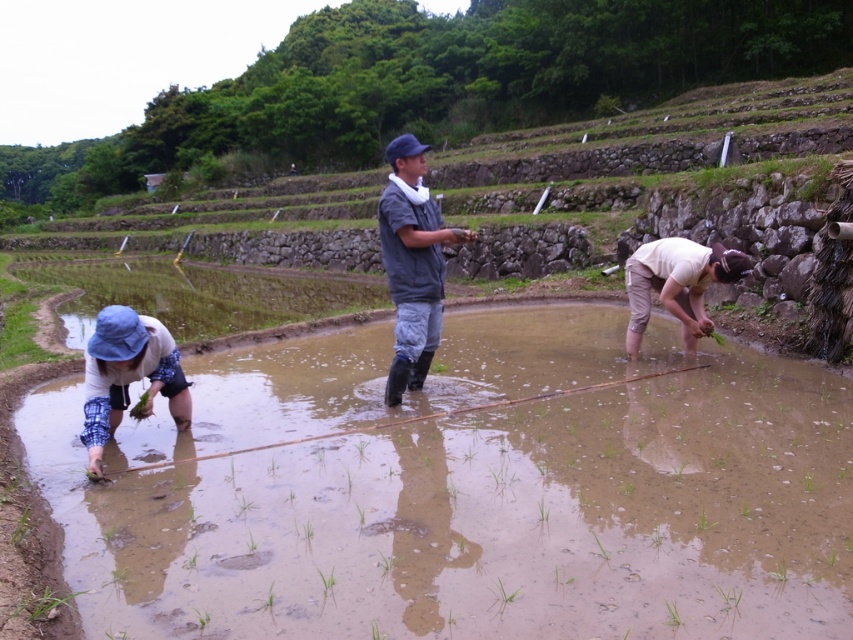
Who is positioned more to the left, gray fabric shirt at center or light beige fabric at lower right?

gray fabric shirt at center

In the scene shown: Is gray fabric shirt at center smaller than light beige fabric at lower right?

Incorrect, gray fabric shirt at center is not smaller in size than light beige fabric at lower right.

Which is behind, point (453, 243) or point (679, 304)?

The point (679, 304) is more distant.

Where is `gray fabric shirt at center`? This screenshot has width=853, height=640. gray fabric shirt at center is located at coordinates (412, 262).

Does gray fabric shirt at center have a greater width compared to blue fabric hat at lower left?

Yes, gray fabric shirt at center is wider than blue fabric hat at lower left.

Who is more distant from viewer, (419, 378) or (161, 339)?

The point (419, 378) is more distant.

Where is `gray fabric shirt at center`? gray fabric shirt at center is located at coordinates (412, 262).

Can you confirm if brown muddy puddle at lower left is taller than gray fabric shirt at center?

No, brown muddy puddle at lower left is not taller than gray fabric shirt at center.

Which is above, brown muddy puddle at lower left or gray fabric shirt at center?

gray fabric shirt at center is above.

Locate an element on the screen. brown muddy puddle at lower left is located at coordinates (486, 518).